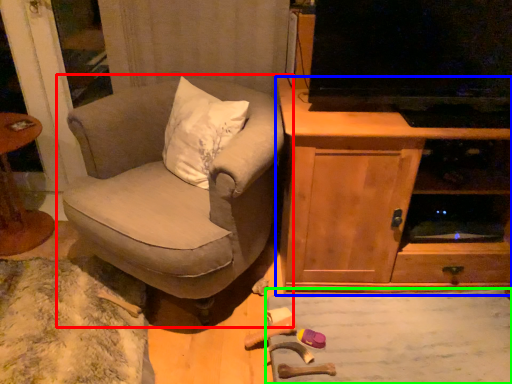
Question: Which object is positioned farthest from chair (highlighted by a red box)? Select from cabinetry (highlighted by a blue box) and plain (highlighted by a green box).

Choices:
 (A) cabinetry
 (B) plain

Answer: (B)